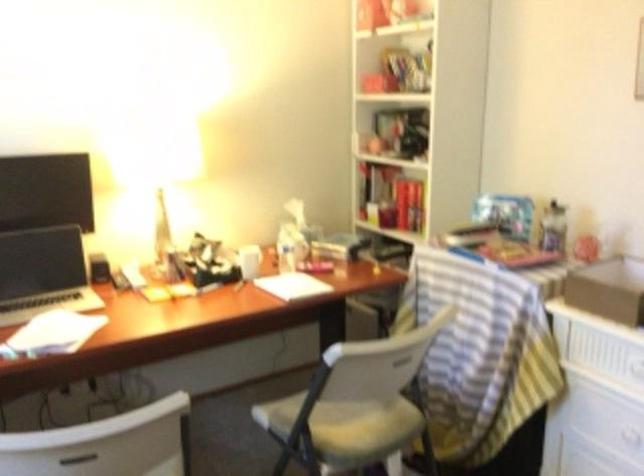
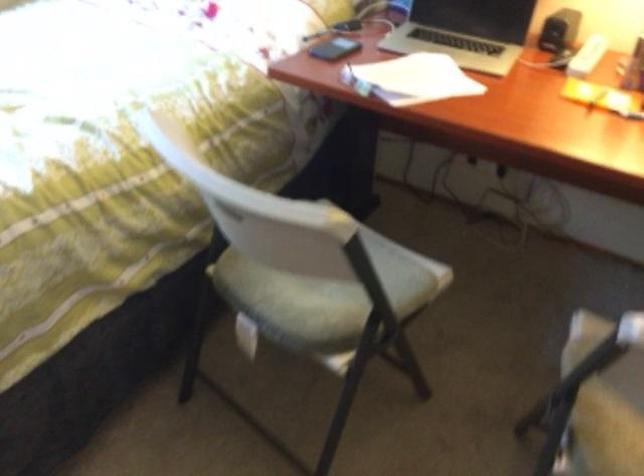
Locate, in the second image, the point that corresponds to [113,270] in the first image.

(559, 30)